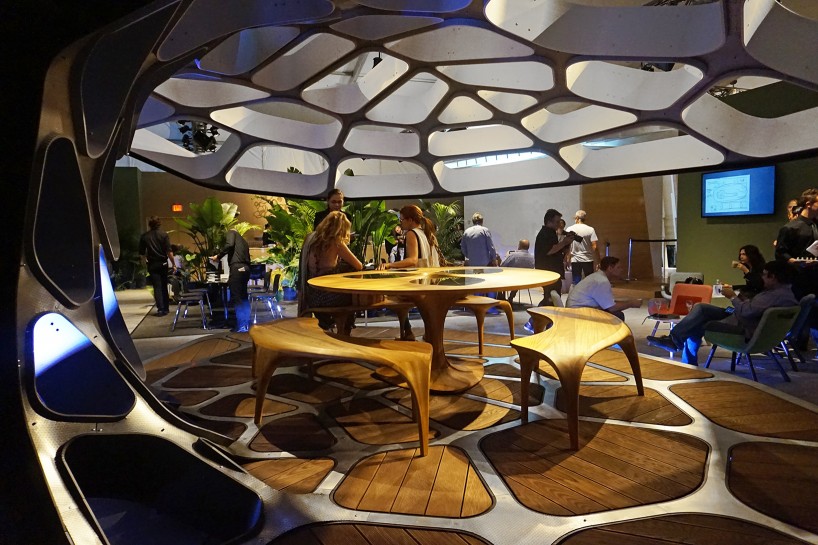
Find the location of a particular element. large round wooden table with glass inserts is located at coordinates pyautogui.click(x=372, y=284), pyautogui.click(x=526, y=281).